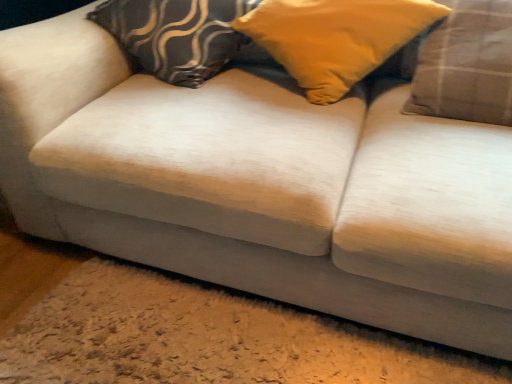
Question: In the image, is plaid fabric pillow at right, which is the first pillow from right to left, positioned in front of or behind yellow fabric pillow at center, marked as the 2th pillow in a right-to-left arrangement?

Choices:
 (A) front
 (B) behind

Answer: (A)

Question: In terms of height, does plaid fabric pillow at right, which is the first pillow from right to left, look taller or shorter compared to yellow fabric pillow at center, the 2th pillow viewed from the left?

Choices:
 (A) tall
 (B) short

Answer: (A)

Question: Which is nearer to the velvet-patterned pillow at center, the third pillow in the right-to-left sequence?

Choices:
 (A) plaid fabric pillow at right, which is the third pillow from left to right
 (B) yellow fabric pillow at center, the 2th pillow viewed from the left

Answer: (B)

Question: Estimate the real-world distances between objects in this image. Which object is closer to the velvet-patterned pillow at center, which ranks as the first pillow in left-to-right order?

Choices:
 (A) plaid fabric pillow at right, which is the third pillow from left to right
 (B) yellow fabric pillow at center, the 2th pillow viewed from the left

Answer: (B)